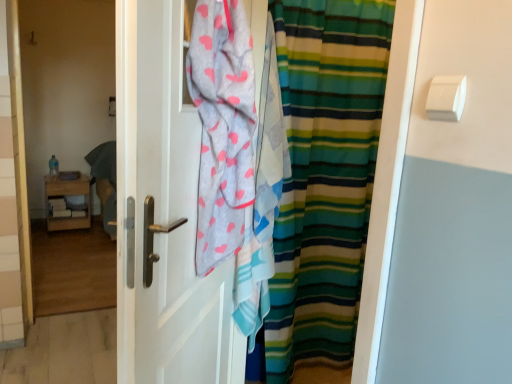
The height and width of the screenshot is (384, 512). What do you see at coordinates (165, 214) in the screenshot? I see `white matte door at center` at bounding box center [165, 214].

This screenshot has height=384, width=512. I want to click on white matte door at center, so [165, 214].

The image size is (512, 384). Find the location of `white plastic towel bar at upper right`. white plastic towel bar at upper right is located at coordinates (446, 98).

Is white matte door at center completely or partially outside of light gray cotton towel at center?

Absolutely, white matte door at center is external to light gray cotton towel at center.

Does point (205, 335) come in front of point (215, 130)?

No.

Is white matte door at center in front of or behind light gray cotton towel at center in the image?

white matte door at center is in front of light gray cotton towel at center.

Locate an element on the screen. Image resolution: width=512 pixels, height=384 pixels. door that is below the light gray cotton towel at center (from the image's perspective) is located at coordinates (165, 214).

This screenshot has height=384, width=512. In the image, there is a light gray cotton towel at center. What are the coordinates of `furniture below it (from a real-world perspective)` in the screenshot? It's located at (68, 195).

Is woodenmaterial/texturenightstand at left at the back of light gray cotton towel at center?

That's not correct — light gray cotton towel at center is not looking away from woodenmaterial/texturenightstand at left.

From the image's perspective, is light gray cotton towel at center on top of woodenmaterial/texturenightstand at left?

Correct, light gray cotton towel at center appears higher than woodenmaterial/texturenightstand at left in the image.

Is white plastic towel bar at upper right aimed at white matte door at center?

No, white plastic towel bar at upper right is not aimed at white matte door at center.

Based on their positions, is white plastic towel bar at upper right located to the left or right of white matte door at center?

Based on their positions, white plastic towel bar at upper right is located to the right of white matte door at center.

Is white plastic towel bar at upper right closer to camera compared to white matte door at center?

Yes, it is.

Find the location of a particular element. curtain below the teal fabric at left (from the image's perspective) is located at coordinates (323, 179).

From the image's perspective, does striped fabric curtain at center appear higher than teal fabric at left?

Actually, striped fabric curtain at center appears below teal fabric at left in the image.

Does striped fabric curtain at center appear on the right side of teal fabric at left?

Yes, striped fabric curtain at center is to the right of teal fabric at left.

Consider the image. Between light gray cotton towel at center and white matte door at center, which one has smaller width?

With smaller width is white matte door at center.

Which of these two, light gray cotton towel at center or white matte door at center, stands shorter?

With less height is light gray cotton towel at center.

From the image's perspective, which object appears higher, light gray cotton towel at center or white matte door at center?

light gray cotton towel at center is shown above in the image.

Is the depth of white plastic towel bar at upper right greater than that of light gray cotton towel at center?

No, it is not.

From the picture: Does white plastic towel bar at upper right have a lesser width compared to light gray cotton towel at center?

Yes, white plastic towel bar at upper right is thinner than light gray cotton towel at center.

Where is `towel bar that appears on the right of light gray cotton towel at center`? The height and width of the screenshot is (384, 512). towel bar that appears on the right of light gray cotton towel at center is located at coordinates (446, 98).

From the image's perspective, relative to light gray cotton towel at center, is white plastic towel bar at upper right above or below?

white plastic towel bar at upper right is situated higher than light gray cotton towel at center in the image.

Which object is thinner, light gray cotton towel at center or white plastic towel bar at upper right?

Thinner between the two is white plastic towel bar at upper right.

Measure the distance from light gray cotton towel at center to white plastic towel bar at upper right.

A distance of 25.02 inches exists between light gray cotton towel at center and white plastic towel bar at upper right.

From the image's perspective, is light gray cotton towel at center over white plastic towel bar at upper right?

No.

Consider the image. From a real-world perspective, is light gray cotton towel at center on top of white plastic towel bar at upper right?

Actually, light gray cotton towel at center is physically below white plastic towel bar at upper right in the real world.

Where is `beach towel that appears behind the white matte door at center`? This screenshot has width=512, height=384. beach towel that appears behind the white matte door at center is located at coordinates (222, 127).

At what (x,y) coordinates should I click in order to perform the action: click on beach towel in front of the woodenmaterial/texturenightstand at left. Please return your answer as a coordinate pair (x, y). Image resolution: width=512 pixels, height=384 pixels. Looking at the image, I should click on (222, 127).

From the image, which object appears to be nearer to striped fabric curtain at center, teal fabric at left or white matte door at center?

Among the two, white matte door at center is located nearer to striped fabric curtain at center.

Estimate the real-world distances between objects in this image. Which object is closer to light gray cotton towel at center, teal fabric at left or woodenmaterial/texturenightstand at left?

woodenmaterial/texturenightstand at left is closer to light gray cotton towel at center.

Which object lies nearer to the anchor point striped fabric curtain at center, teal fabric at left or white plastic towel bar at upper right?

Based on the image, white plastic towel bar at upper right appears to be nearer to striped fabric curtain at center.

Which object lies further to the anchor point white matte door at center, light gray cotton towel at center or striped fabric curtain at center?

striped fabric curtain at center.

Considering their positions, is white plastic towel bar at upper right positioned closer to teal fabric at left than white matte door at center?

white matte door at center lies closer to teal fabric at left than the other object.

Considering their positions, is light gray cotton towel at center positioned closer to striped fabric curtain at center than teal fabric at left?

The object closer to striped fabric curtain at center is light gray cotton towel at center.

Looking at the image, which one is located further to striped fabric curtain at center, woodenmaterial/texturenightstand at left or light gray cotton towel at center?

The object further to striped fabric curtain at center is woodenmaterial/texturenightstand at left.

Which object lies nearer to the anchor point white matte door at center, striped fabric curtain at center or teal fabric at left?

striped fabric curtain at center lies closer to white matte door at center than the other object.

Where is `furniture positioned between white matte door at center and teal fabric at left from near to far`? Image resolution: width=512 pixels, height=384 pixels. furniture positioned between white matte door at center and teal fabric at left from near to far is located at coordinates (68, 195).

You are a GUI agent. You are given a task and a screenshot of the screen. Output one action in this format:
    pyautogui.click(x=<x>, y=<y>)
    Task: Click on the beach towel between white plastic towel bar at upper right and woodenmaterial/texturenightstand at left in the front-back direction
    
    Given the screenshot: What is the action you would take?
    pyautogui.click(x=222, y=127)

Locate an element on the screen. beach towel positioned between white matte door at center and teal fabric at left from near to far is located at coordinates (222, 127).

Locate an element on the screen. This screenshot has width=512, height=384. furniture between white plastic towel bar at upper right and teal fabric at left along the z-axis is located at coordinates (68, 195).